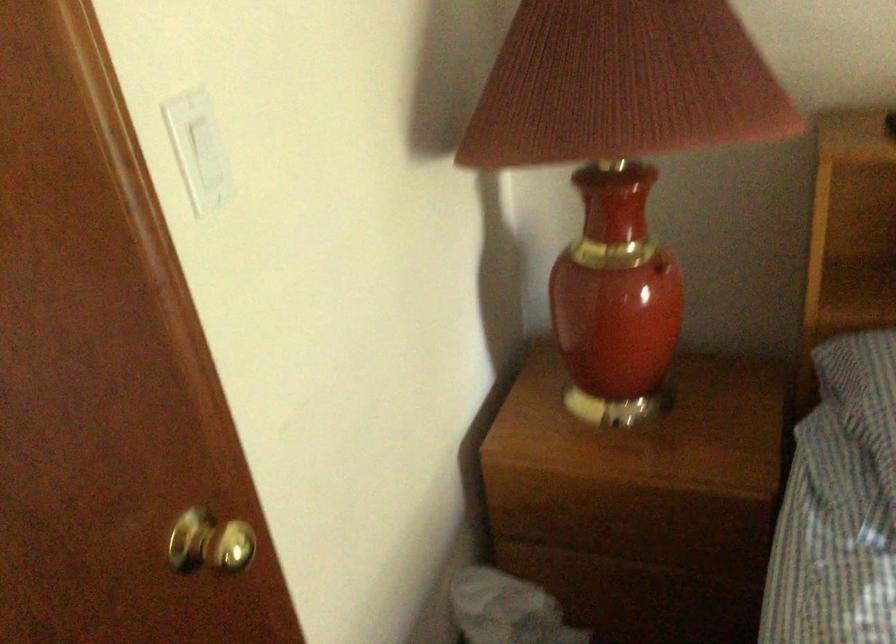
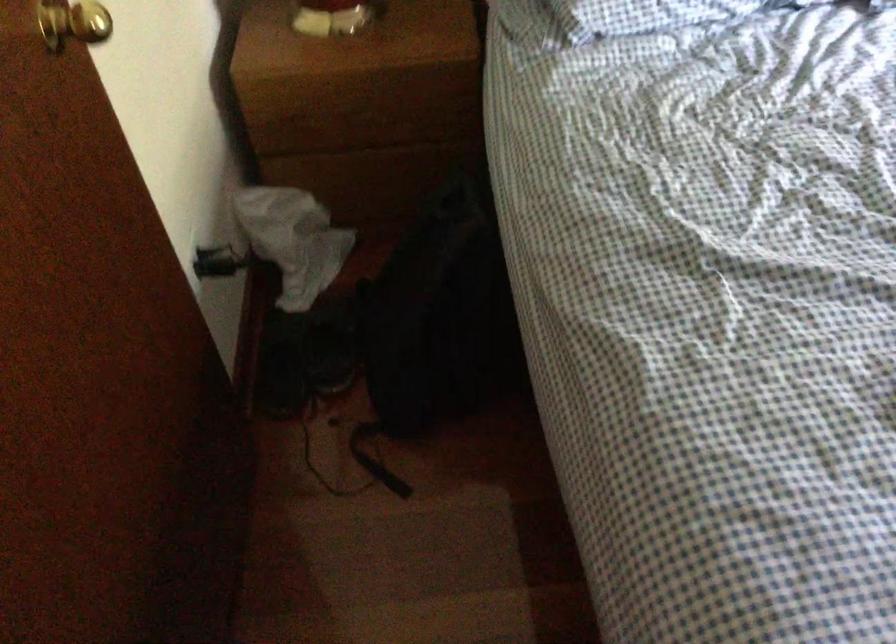
Where in the second image is the point corresponding to (x=225, y=553) from the first image?

(73, 23)